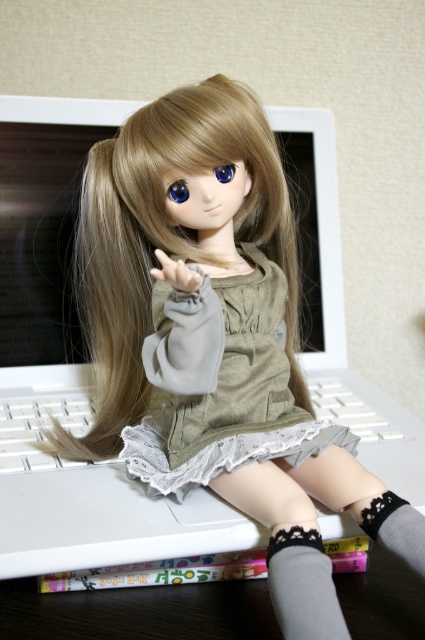
Does gray lace sock at lower center have a lesser height compared to gray knitted sock at lower right?

In fact, gray lace sock at lower center may be taller than gray knitted sock at lower right.

Between gray lace sock at lower center and gray knitted sock at lower right, which one is positioned lower?

gray lace sock at lower center is lower down.

Does point (285, 580) come behind point (410, 556)?

That is False.

Where is `gray lace sock at lower center`? The image size is (425, 640). gray lace sock at lower center is located at coordinates (303, 586).

Consider the image. Between olive green fabric dress at center and dark wood table at lower center, which one has less height?

dark wood table at lower center is shorter.

Which is behind, point (170, 458) or point (201, 630)?

The point (170, 458) is behind.

This screenshot has width=425, height=640. In order to click on olive green fabric dress at center in this screenshot , I will do `click(221, 385)`.

Who is taller, dark wood table at lower center or gray lace sock at lower center?

With more height is gray lace sock at lower center.

Which is in front, point (209, 630) or point (308, 564)?

Point (308, 564)

Who is more forward, [204,593] or [317,600]?

Positioned in front is point [317,600].

The image size is (425, 640). Find the location of `dark wood table at lower center`. dark wood table at lower center is located at coordinates (138, 612).